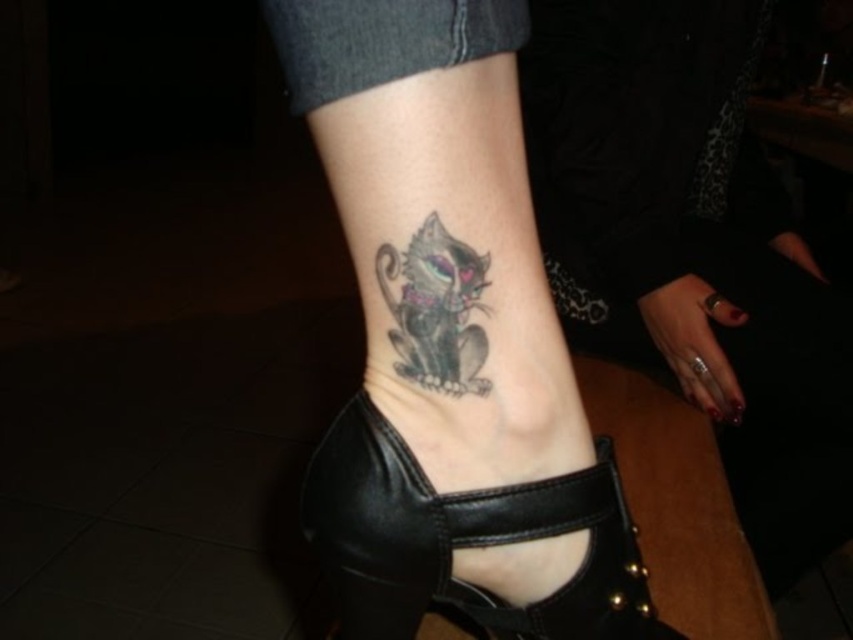
You are a photographer taking a close up shot of a person wearing a black leather sandal at lower center and a shiny black cat at lower center. Which object is closer to the camera?

The black leather sandal at lower center is closer to the camera than the shiny black cat at lower center.

You are standing in front of the image and notice the black leather sandal at lower center and the shiny black cat at lower center. Which object is positioned to the right of the other?

The black leather sandal at lower center is to the right of the shiny black cat at lower center.